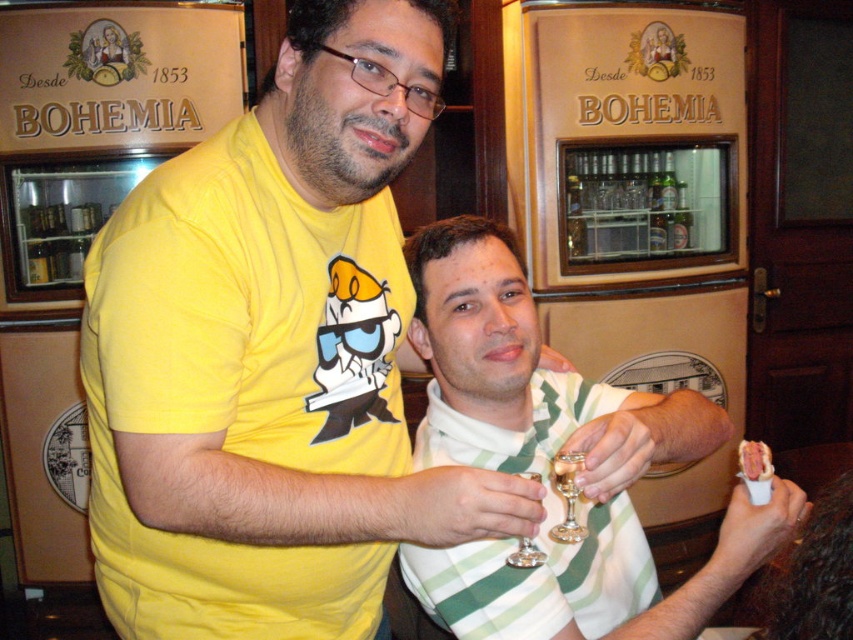
Question: Does green striped shirt at center have a larger size compared to clear glass bottles at center?

Choices:
 (A) yes
 (B) no

Answer: (B)

Question: Which of the following is the farthest from the observer?

Choices:
 (A) white striped shirt at center
 (B) clear glass bottles at center
 (C) green striped shirt at center
 (D) transparent glass at center

Answer: (B)

Question: Among these objects, which one is nearest to the camera?

Choices:
 (A) transparent glass at center
 (B) green striped shirt at center
 (C) white striped shirt at center

Answer: (C)

Question: Does green striped shirt at center have a lesser width compared to clear glass bottles at center?

Choices:
 (A) no
 (B) yes

Answer: (B)

Question: Can you confirm if white striped shirt at center is positioned to the right of green striped shirt at center?

Choices:
 (A) no
 (B) yes

Answer: (A)

Question: Which of the following is the farthest from the observer?

Choices:
 (A) (701, 620)
 (B) (577, 472)
 (C) (659, 189)
 (D) (605, 522)

Answer: (C)